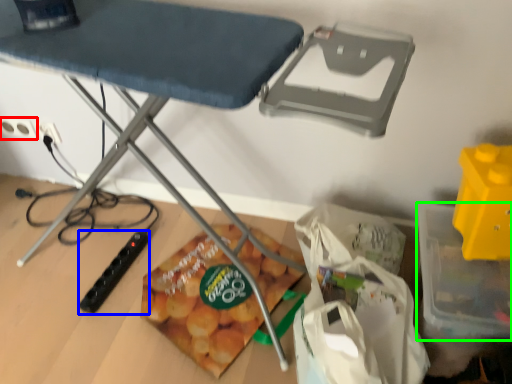
Question: Which is farther away from electric outlet (highlighted by a red box)? toy (highlighted by a blue box) or storage box (highlighted by a green box)?

Choices:
 (A) toy
 (B) storage box

Answer: (B)